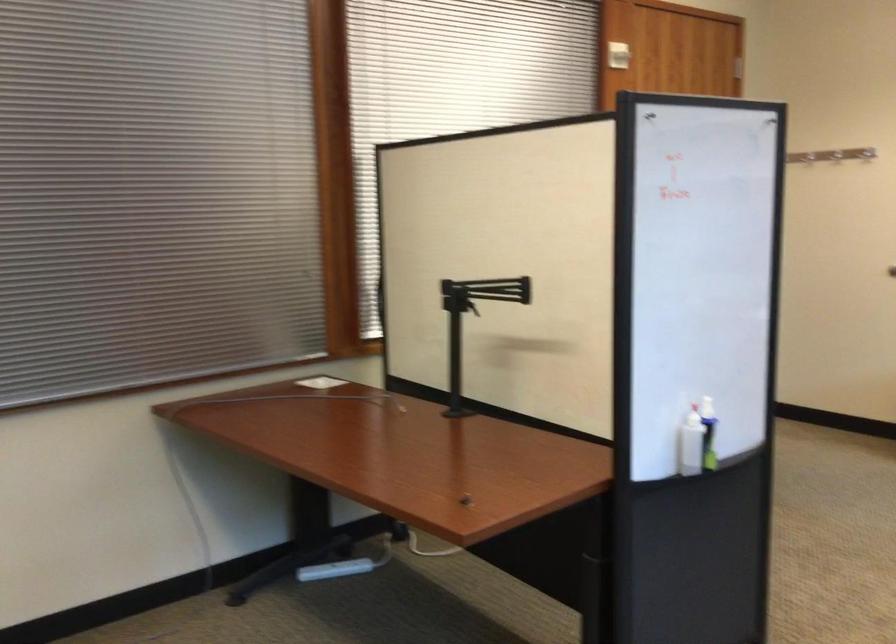
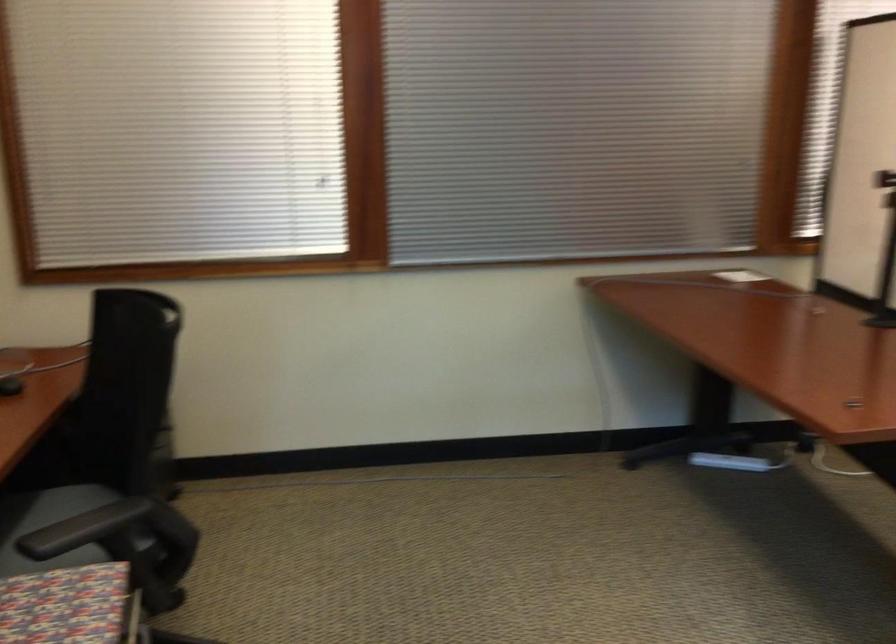
The point at (346, 567) is marked in the first image. Where is the corresponding point in the second image?

(730, 462)